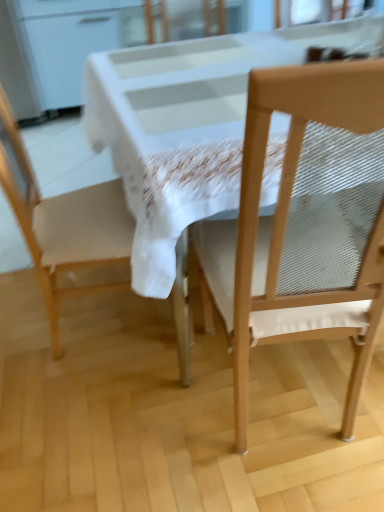
Question: Considering the relative positions of wooden chair at right, acting as the 1th chair starting from the right, and matte white chair at left, positioned as the first chair in left-to-right order, in the image provided, is wooden chair at right, acting as the 1th chair starting from the right, to the left or to the right of matte white chair at left, positioned as the first chair in left-to-right order,?

Choices:
 (A) right
 (B) left

Answer: (A)

Question: Considering their positions, is wooden chair at right, marked as the second chair in a left-to-right arrangement, located in front of or behind matte white chair at left, which appears as the 2th chair when viewed from the right?

Choices:
 (A) behind
 (B) front

Answer: (B)

Question: Based on their relative distances, which object is farther from the white glossy table at center?

Choices:
 (A) wooden chair at right, marked as the second chair in a left-to-right arrangement
 (B) matte white chair at left, which appears as the 2th chair when viewed from the right

Answer: (B)

Question: Estimate the real-world distances between objects in this image. Which object is farther from the wooden chair at right, acting as the 1th chair starting from the right?

Choices:
 (A) white glossy table at center
 (B) matte white chair at left, which appears as the 2th chair when viewed from the right

Answer: (B)